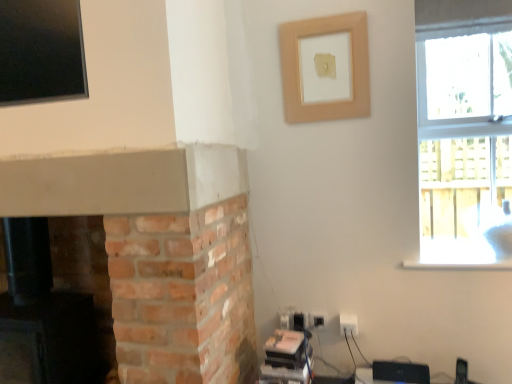
Question: Looking at their shapes, would you say clear glass window at upper right is wider or thinner than white plastic electric outlet at lower right?

Choices:
 (A) wide
 (B) thin

Answer: (A)

Question: Considering the positions of point (502, 125) and point (352, 334), is point (502, 125) closer or farther from the camera than point (352, 334)?

Choices:
 (A) closer
 (B) farther

Answer: (B)

Question: Based on their relative distances, which object is farther from the wooden frame at upper center?

Choices:
 (A) clear glass window at upper right
 (B) brick fireplace at lower left
 (C) white plastic electric outlet at lower right

Answer: (A)

Question: Considering the real-world distances, which object is closest to the brick fireplace at lower left?

Choices:
 (A) wooden frame at upper center
 (B) white plastic electric outlet at lower right
 (C) clear glass window at upper right

Answer: (B)